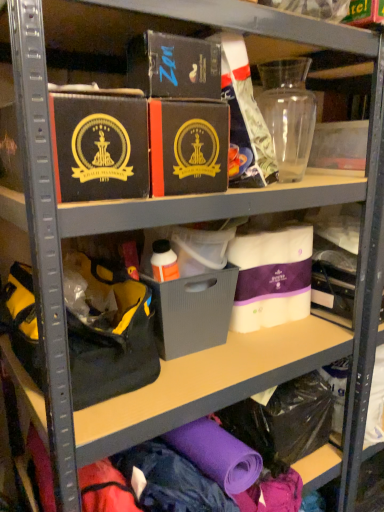
Question: From the image's perspective, is matte black box at center, the 3th box viewed from the right, positioned above or below white fabric quilted mattress at center, the first box when ordered from right to left?

Choices:
 (A) above
 (B) below

Answer: (A)

Question: Looking at their shapes, would you say matte black box at center, the 3th box viewed from the right, is wider or thinner than white fabric quilted mattress at center, the first box when ordered from right to left?

Choices:
 (A) thin
 (B) wide

Answer: (B)

Question: Which is nearer to the white fabric quilted mattress at center, which is counted as the 4th box, starting from the left?

Choices:
 (A) gray matte storage box at center
 (B) black fabric handbag at left
 (C) matte black box at center, the second box in the left-to-right sequence
 (D) matte black box at upper left, which ranks as the fourth box in right-to-left order
 (E) matte black box at upper center, which is counted as the third box, starting from the left

Answer: (A)

Question: Which of these objects is positioned closest to the black fabric handbag at left?

Choices:
 (A) white fabric quilted mattress at center, the first box when ordered from right to left
 (B) matte black box at upper left, which ranks as the fourth box in right-to-left order
 (C) matte black box at center, the second box in the left-to-right sequence
 (D) matte black box at upper center, which is counted as the third box, starting from the left
 (E) gray matte storage box at center

Answer: (E)